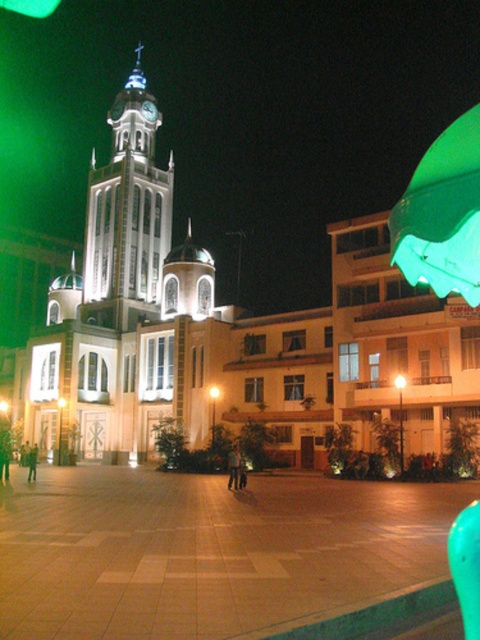
You are an architect designing a new public square and want to ensure that the white glass clock tower at center will not block the view of the green fabric umbrella at upper right from the main entrance. Based on their sizes, can you determine if the clock tower will block the umbrella?

The white glass clock tower at center is narrower than the green fabric umbrella at upper right, so it is possible that the tower may not fully block the view of the umbrella depending on their positions. However, without knowing the exact distance between them, it is difficult to confirm.

In the scene shown: You are a visitor in the plaza and want to find a spot under the green fabric umbrella at upper right. Where should you look for it relative to the smooth stone pavement at center?

The smooth stone pavement at center is positioned under the green fabric umbrella at upper right, so the umbrella is above the smooth stone pavement at center. To find the umbrella, look above the smooth stone pavement at center.

You are standing in the square and want to take a photo of the white glass clock tower at center. To ensure the clock tower is fully visible in the frame, should you position yourself closer to the smooth stone pavement at center or farther away?

You should position yourself farther away from the smooth stone pavement at center to ensure the white glass clock tower at center is fully visible in the frame, as the clock tower is taller than the pavement.